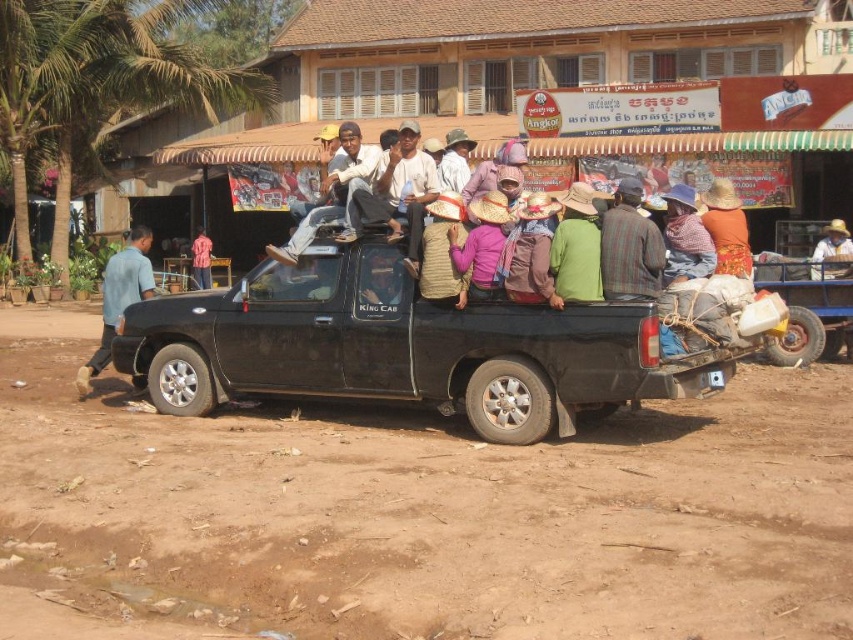
Question: Where is blue cotton shirt at left located in relation to orange woven cloth at center in the image?

Choices:
 (A) below
 (B) above

Answer: (B)

Question: Is brown woven basket at center to the right of plaid fabric shirt at center from the viewer's perspective?

Choices:
 (A) no
 (B) yes

Answer: (A)

Question: From the image, what is the correct spatial relationship of dirt field at lower center in relation to orange woven cloth at center?

Choices:
 (A) above
 (B) below

Answer: (B)

Question: Which is nearer to the orange woven cloth at center?

Choices:
 (A) black matte truck at center
 (B) blue cotton shirt at left
 (C) dirt field at lower center
 (D) plaid fabric shirt at center

Answer: (D)

Question: Which object is farther from the camera taking this photo?

Choices:
 (A) red shirt at center
 (B) brown woven basket at center
 (C) black matte truck at center

Answer: (A)

Question: Which object appears closest to the camera in this image?

Choices:
 (A) red shirt at center
 (B) plaid fabric shirt at center
 (C) blue cotton shirt at left
 (D) brown woven hat at center

Answer: (B)